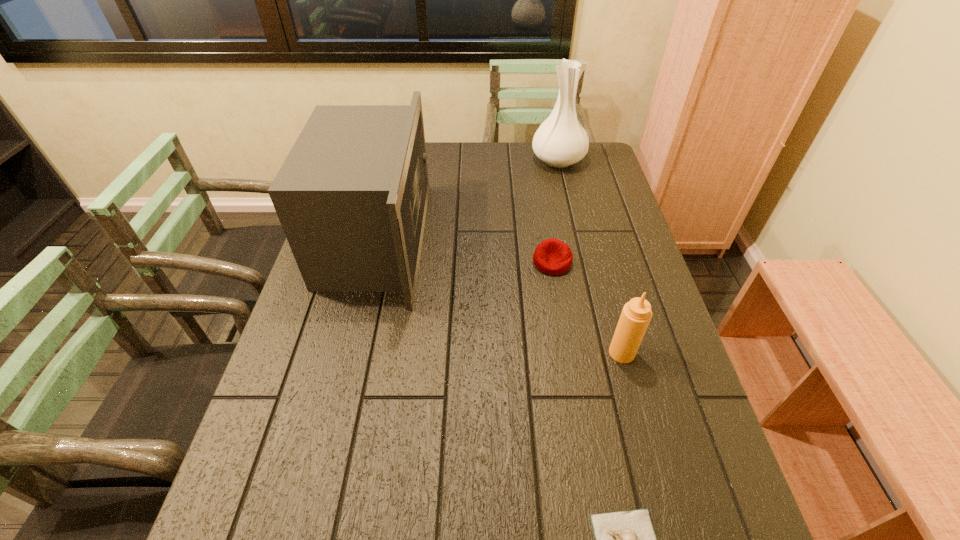
Identify the location of object present at the left edge. (351, 196).

Where is `vase that is positioned at the right edge`? The image size is (960, 540). vase that is positioned at the right edge is located at coordinates (560, 141).

What are the coordinates of `condiment positioned at the right edge` in the screenshot? It's located at (635, 317).

Locate an element on the screen. object located in the far right corner section of the desktop is located at coordinates (560, 141).

Find the location of a particular element. The image size is (960, 540). free space at the far edge of the desktop is located at coordinates (528, 169).

At what (x,y) coordinates should I click in order to perform the action: click on free location at the left edge. Please return your answer as a coordinate pair (x, y). This screenshot has width=960, height=540. Looking at the image, I should click on (309, 403).

In the image, there is a desktop. What are the coordinates of `vacant area at the right edge` in the screenshot? It's located at 662,523.

You are a GUI agent. You are given a task and a screenshot of the screen. Output one action in this format:
    pyautogui.click(x=<x>, y=<y>)
    Task: Click on the free space between the vase and the second shortest object
    
    Given the screenshot: What is the action you would take?
    pyautogui.click(x=555, y=211)

Where is `free space between the second shortest object and the farthest object`? free space between the second shortest object and the farthest object is located at coordinates (555, 211).

At what (x,y) coordinates should I click in order to perform the action: click on vacant region between the condiment and the vase. Please return your answer as a coordinate pair (x, y). The width and height of the screenshot is (960, 540). Looking at the image, I should click on point(590,256).